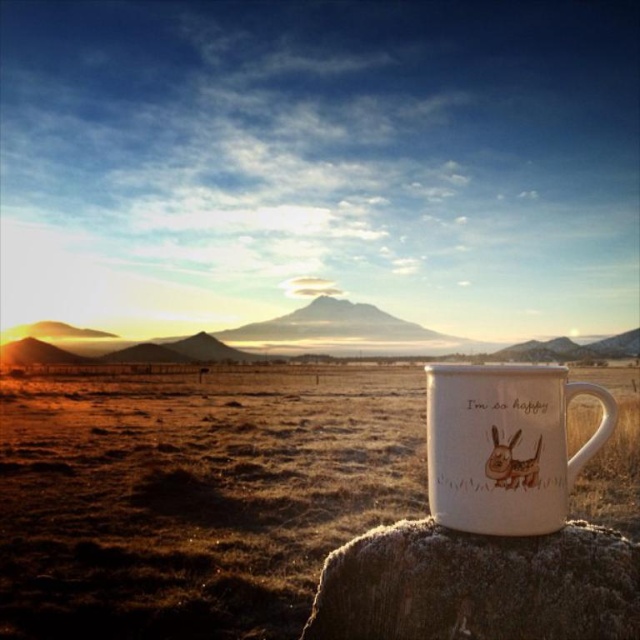
Can you confirm if white frosty rock at lower center is positioned above white ceramic mug at lower right?

No.

Find the location of a particular element. The image size is (640, 640). white frosty rock at lower center is located at coordinates (477, 586).

The image size is (640, 640). Identify the location of white frosty rock at lower center. (477, 586).

What do you see at coordinates (195, 497) in the screenshot? I see `white matte cup at center` at bounding box center [195, 497].

Measure the distance between white matte cup at center and camera.

A distance of 5.98 feet exists between white matte cup at center and camera.

Measure the distance between point (353, 461) and camera.

The distance of point (353, 461) from camera is 10.36 meters.

Locate an element on the screen. This screenshot has height=640, width=640. white matte cup at center is located at coordinates (195, 497).

Between white matte cup at center and white ceramic mug at lower right, which one has more height?

white matte cup at center

Does white matte cup at center have a greater height compared to white ceramic mug at lower right?

Indeed, white matte cup at center has a greater height compared to white ceramic mug at lower right.

Identify the location of white matte cup at center. (195, 497).